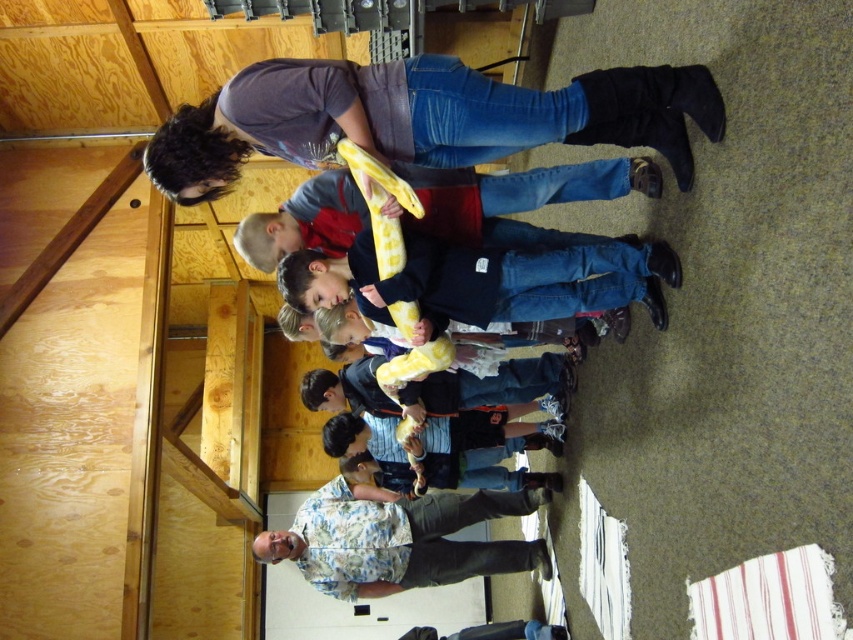
You are standing at the entrance of the barn and want to find the man in the floral shirt at lower center. Based on the coordinates provided in the description, in which direction should you look relative to your position?

The floral shirt at lower center is located at coordinates point (399, 540), which means you should look towards the lower center direction relative to your position at the entrance.

You are standing in the room and want to place a small decoration between the two points, point [469,97] and point [527,540]. Which point should the decoration be closer to in order to appear larger from your current viewpoint?

The decoration should be placed closer to point [469,97] because it is closer to the camera, making objects placed there appear larger from your viewpoint.